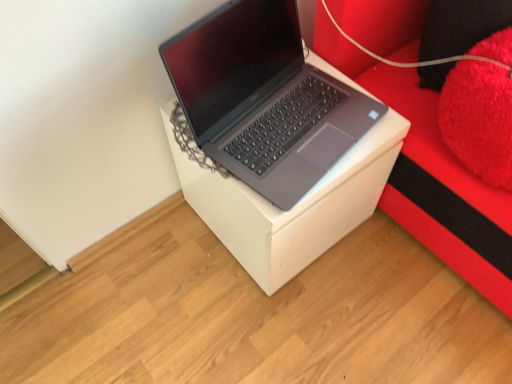
Question: Considering the relative sizes of white cardboard box at center and black fuzzy pillow at upper right, which appears as the 2th pillow when ordered from the bottom, in the image provided, is white cardboard box at center taller than black fuzzy pillow at upper right, which appears as the 2th pillow when ordered from the bottom,?

Choices:
 (A) no
 (B) yes

Answer: (B)

Question: From a real-world perspective, is white cardboard box at center physically below black fuzzy pillow at upper right, which appears as the 2th pillow when ordered from the bottom?

Choices:
 (A) no
 (B) yes

Answer: (B)

Question: Is white cardboard box at center not inside black fuzzy pillow at upper right, which appears as the 2th pillow when ordered from the bottom?

Choices:
 (A) no
 (B) yes

Answer: (B)

Question: Is white cardboard box at center bigger than black fuzzy pillow at upper right, which appears as the 2th pillow when ordered from the bottom?

Choices:
 (A) no
 (B) yes

Answer: (B)

Question: Can you confirm if white cardboard box at center is thinner than black fuzzy pillow at upper right, which appears as the 2th pillow when ordered from the bottom?

Choices:
 (A) yes
 (B) no

Answer: (B)

Question: From a real-world perspective, is sleek silver laptop at center physically located above or below fluffy red pillow at upper right, which is the 1th pillow in bottom-to-top order?

Choices:
 (A) below
 (B) above

Answer: (A)

Question: Considering their positions, is sleek silver laptop at center located in front of or behind fluffy red pillow at upper right, which is the 1th pillow in bottom-to-top order?

Choices:
 (A) front
 (B) behind

Answer: (B)

Question: Is sleek silver laptop at center inside or outside of fluffy red pillow at upper right, which is the 1th pillow in bottom-to-top order?

Choices:
 (A) outside
 (B) inside

Answer: (A)

Question: Is sleek silver laptop at center to the left or to the right of fluffy red pillow at upper right, the second pillow when ordered from top to bottom, in the image?

Choices:
 (A) left
 (B) right

Answer: (A)

Question: From the image's perspective, is black fuzzy pillow at upper right, which appears as the 2th pillow when ordered from the bottom, located above or below white cardboard box at center?

Choices:
 (A) below
 (B) above

Answer: (B)

Question: Based on their sizes in the image, would you say black fuzzy pillow at upper right, which is counted as the first pillow, starting from the top, is bigger or smaller than white cardboard box at center?

Choices:
 (A) small
 (B) big

Answer: (A)

Question: In terms of height, does black fuzzy pillow at upper right, which is counted as the first pillow, starting from the top, look taller or shorter compared to white cardboard box at center?

Choices:
 (A) tall
 (B) short

Answer: (B)

Question: Does point (430, 3) appear closer or farther from the camera than point (266, 259)?

Choices:
 (A) closer
 (B) farther

Answer: (B)

Question: Based on their positions, is red plush cushion at right located to the left or right of sleek silver laptop at center?

Choices:
 (A) right
 (B) left

Answer: (A)

Question: Is point (419, 1) positioned closer to the camera than point (234, 115)?

Choices:
 (A) farther
 (B) closer

Answer: (A)